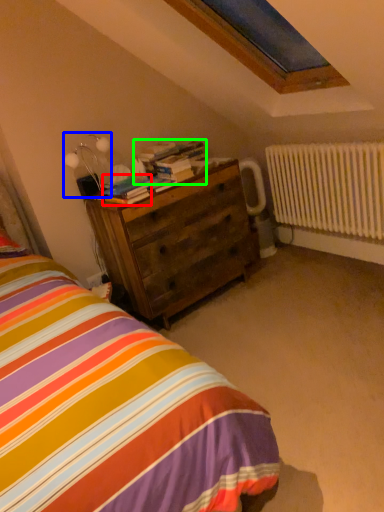
Question: Which object is positioned closest to book (highlighted by a red box)? Select from table lamp (highlighted by a blue box) and book (highlighted by a green box).

Choices:
 (A) table lamp
 (B) book

Answer: (B)